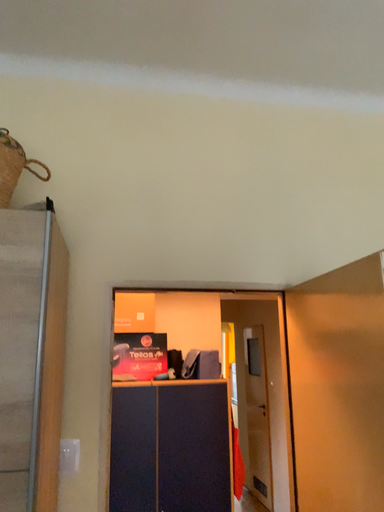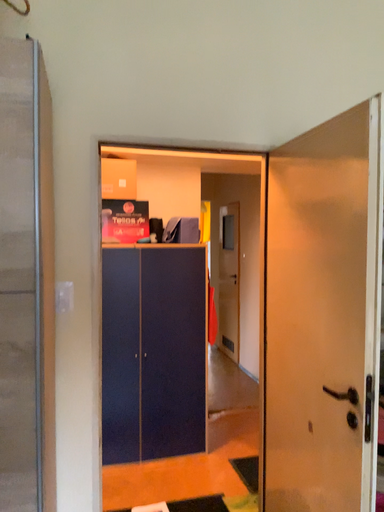
Question: How did the camera likely rotate when shooting the video?

Choices:
 (A) rotated downward
 (B) rotated upward

Answer: (A)